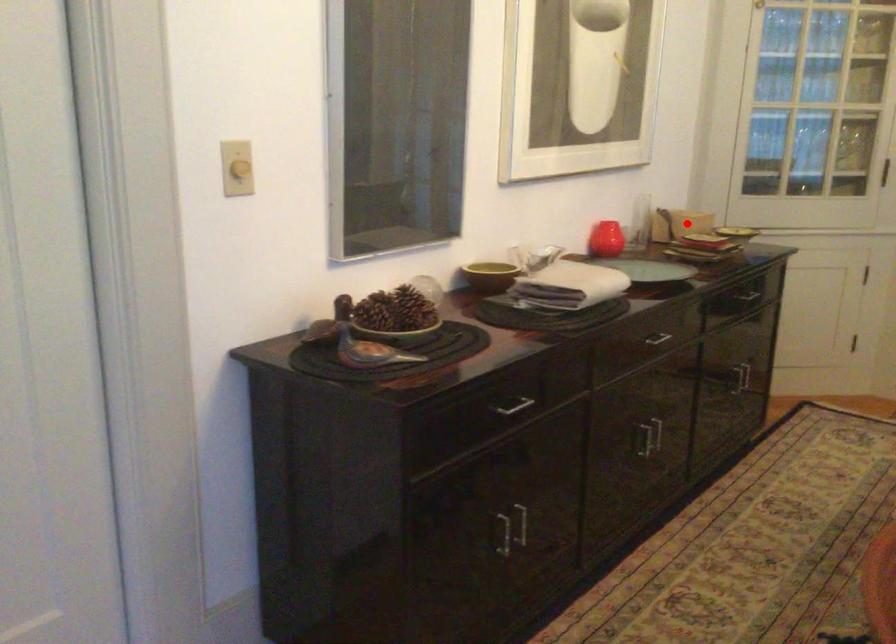
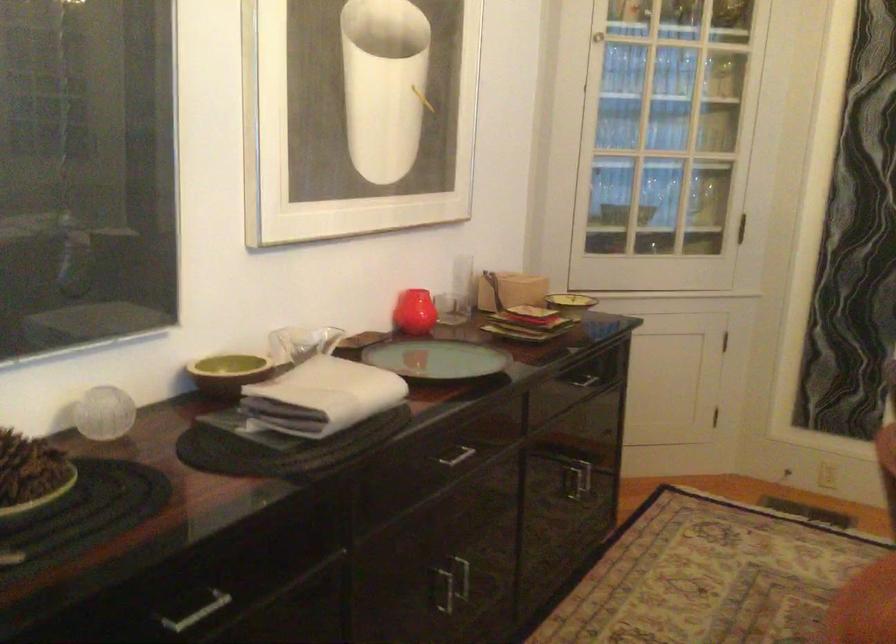
In the second image, find the point that corresponds to the highlighted location in the first image.

(510, 290)